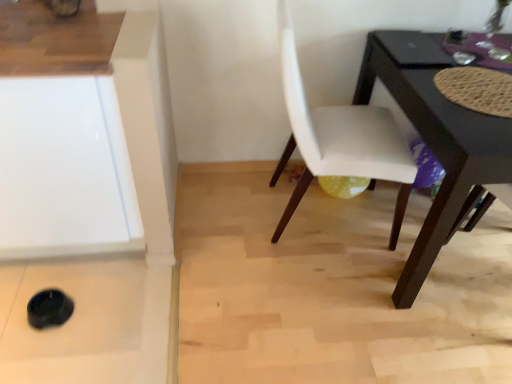
Image resolution: width=512 pixels, height=384 pixels. In order to click on vacant space to the left of glossy black table at lower right in this screenshot , I will do `click(270, 274)`.